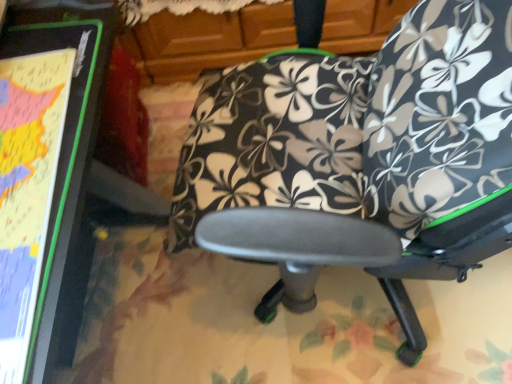
Question: Can you confirm if matte black board at left is smaller than black fabric chair at center?

Choices:
 (A) no
 (B) yes

Answer: (B)

Question: Can you confirm if matte black board at left is positioned to the right of black fabric chair at center?

Choices:
 (A) yes
 (B) no

Answer: (B)

Question: Is matte black board at left positioned far away from black fabric chair at center?

Choices:
 (A) yes
 (B) no

Answer: (B)

Question: Is matte black board at left facing towards black fabric chair at center?

Choices:
 (A) yes
 (B) no

Answer: (A)

Question: From the image's perspective, is matte black board at left on top of black fabric chair at center?

Choices:
 (A) yes
 (B) no

Answer: (B)

Question: Is matte black board at left outside black fabric chair at center?

Choices:
 (A) yes
 (B) no

Answer: (A)

Question: Is black floral fabric bean bag chair at center positioned beyond the bounds of black fabric chair at center?

Choices:
 (A) yes
 (B) no

Answer: (B)

Question: Is black floral fabric bean bag chair at center with black fabric chair at center?

Choices:
 (A) yes
 (B) no

Answer: (A)

Question: Is the depth of black floral fabric bean bag chair at center greater than that of black fabric chair at center?

Choices:
 (A) no
 (B) yes

Answer: (B)

Question: From a real-world perspective, is black floral fabric bean bag chair at center physically below black fabric chair at center?

Choices:
 (A) no
 (B) yes

Answer: (A)

Question: Can you confirm if black floral fabric bean bag chair at center is bigger than black fabric chair at center?

Choices:
 (A) yes
 (B) no

Answer: (B)

Question: Is black floral fabric bean bag chair at center not close to black fabric chair at center?

Choices:
 (A) no
 (B) yes

Answer: (A)

Question: From a real-world perspective, is matte black board at left physically above black floral fabric bean bag chair at center?

Choices:
 (A) yes
 (B) no

Answer: (B)